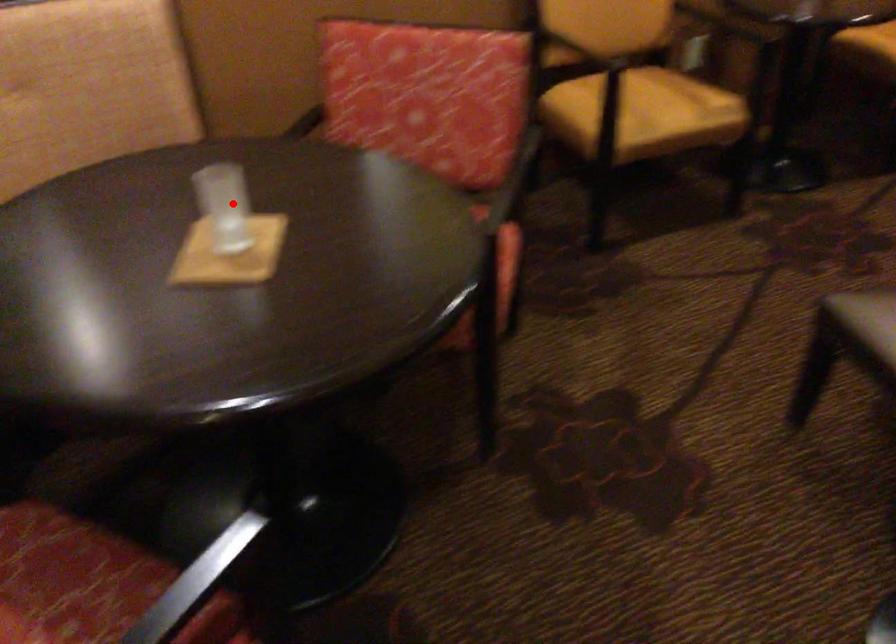
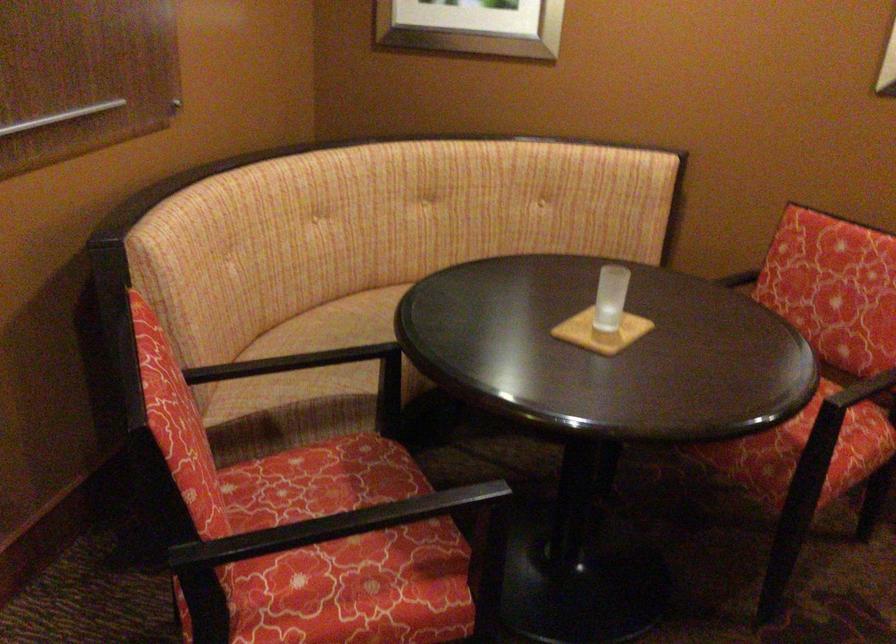
Question: I am providing you with two images of the same scene from different viewpoints. A red point is shown in image1. For the corresponding object point in image2, is it positioned nearer or farther from the camera?

Choices:
 (A) Nearer
 (B) Farther

Answer: (B)